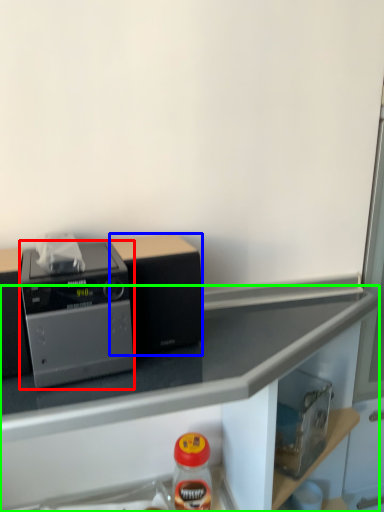
Question: Estimate the real-world distances between objects in this image. Which object is closer to home appliance (highlighted by a red box), appliance (highlighted by a blue box) or countertop (highlighted by a green box)?

Choices:
 (A) appliance
 (B) countertop

Answer: (A)